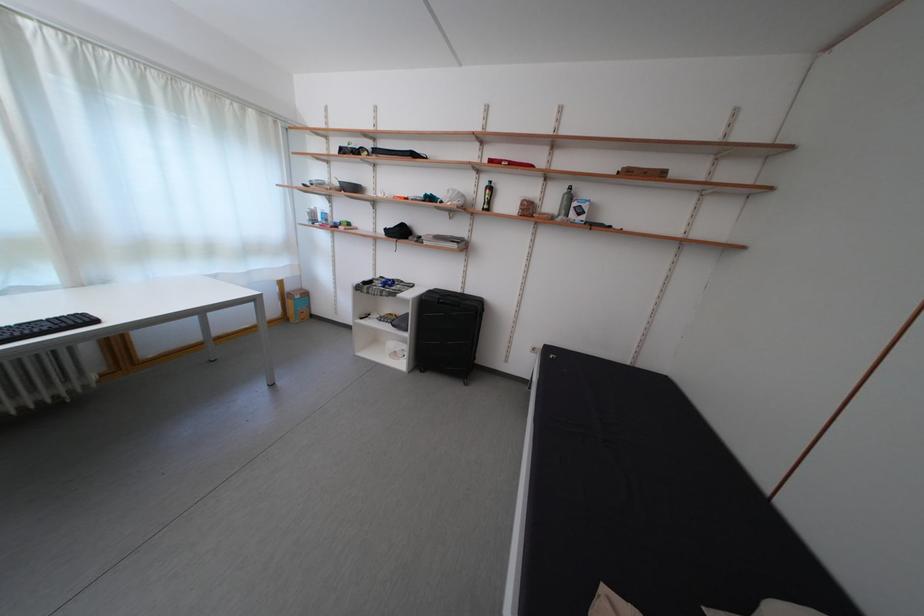
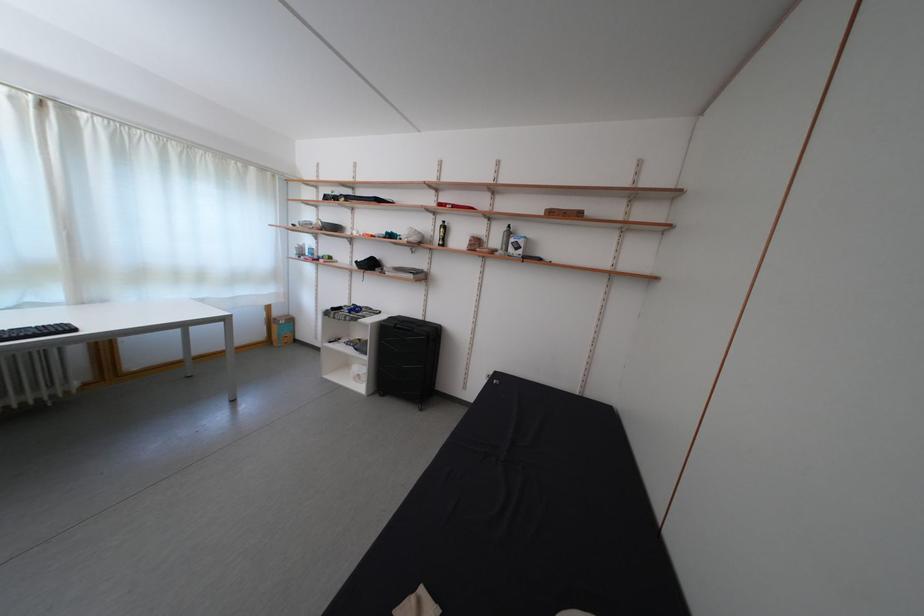
Question: The images are taken continuously from a first-person perspective. In which direction is your viewpoint rotating?

Choices:
 (A) Left
 (B) Right
 (C) Up
 (D) Down

Answer: (C)